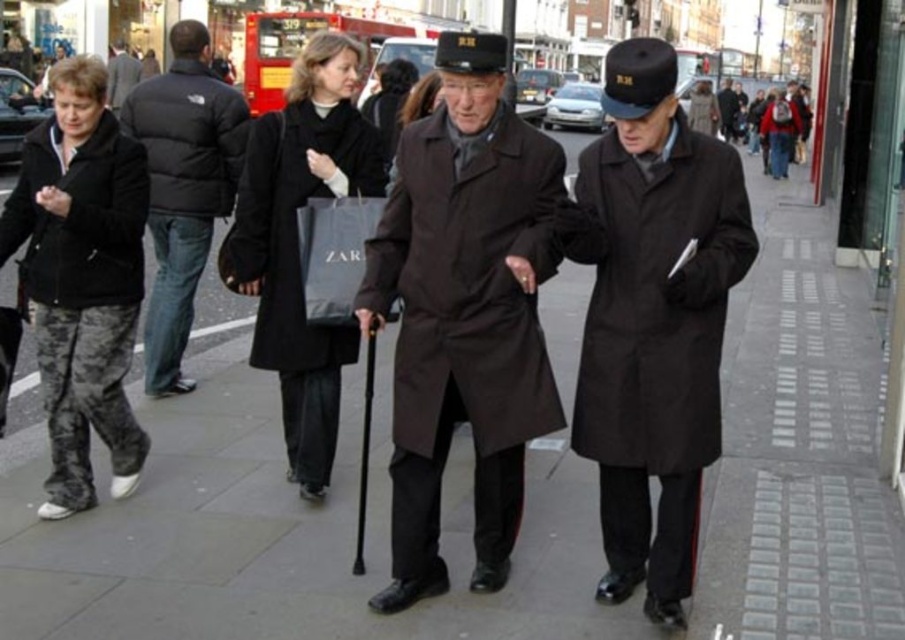
Image resolution: width=905 pixels, height=640 pixels. Describe the element at coordinates (81, 278) in the screenshot. I see `camouflage pants at lower left` at that location.

Which is below, camouflage pants at lower left or dark gray wool coat at upper left?

camouflage pants at lower left is below.

Does point (113, 250) come behind point (112, 68)?

No, it is not.

I want to click on camouflage pants at lower left, so click(81, 278).

Does camouflage pants at lower left come behind dark brown coat at center?

That is False.

Who is lower down, camouflage pants at lower left or dark brown coat at center?

camouflage pants at lower left is lower down.

Between point (27, 300) and point (729, 131), which one is positioned in front?

Positioned in front is point (27, 300).

Find the location of a particular element. camouflage pants at lower left is located at coordinates (81, 278).

Which is below, black matte coat at center or matte black jacket at left?

Positioned lower is black matte coat at center.

Is black matte coat at center in front of matte black jacket at left?

That is True.

Locate an element on the screen. The width and height of the screenshot is (905, 640). black matte coat at center is located at coordinates (297, 243).